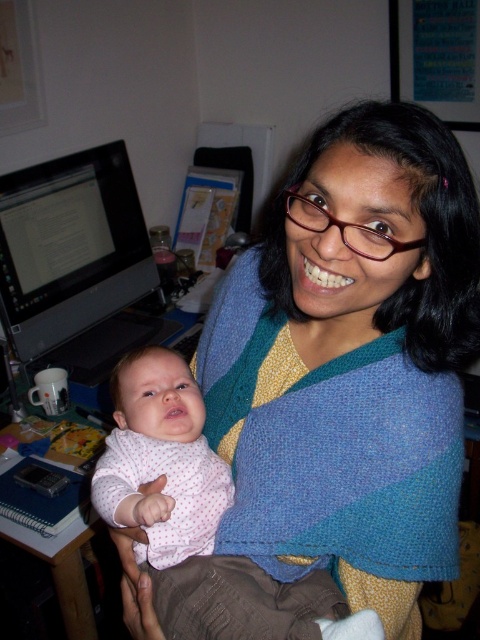
Is pink dotted fabric at center to the right of matte black monitor at left from the viewer's perspective?

Indeed, pink dotted fabric at center is positioned on the right side of matte black monitor at left.

Does pink dotted fabric at center lie behind matte black monitor at left?

That is False.

Where is `pink dotted fabric at center`? Image resolution: width=480 pixels, height=640 pixels. pink dotted fabric at center is located at coordinates (197, 518).

Can you confirm if blue knitted shawl at center is positioned to the right of matte black monitor at left?

Correct, you'll find blue knitted shawl at center to the right of matte black monitor at left.

I want to click on blue knitted shawl at center, so click(350, 362).

Is blue knitted shawl at center smaller than pink dotted fabric at center?

No, blue knitted shawl at center is not smaller than pink dotted fabric at center.

The width and height of the screenshot is (480, 640). I want to click on blue knitted shawl at center, so click(350, 362).